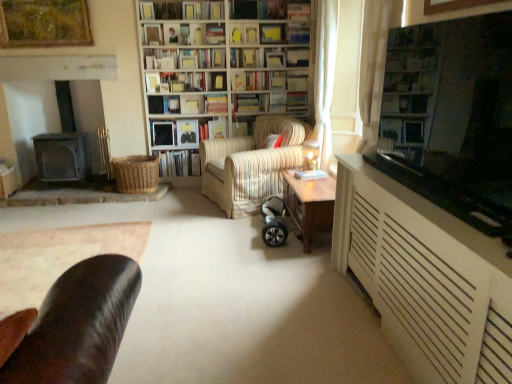
This screenshot has height=384, width=512. What are the coordinates of `free spot in front of silver metallic hoverboard at center` in the screenshot? It's located at (267, 257).